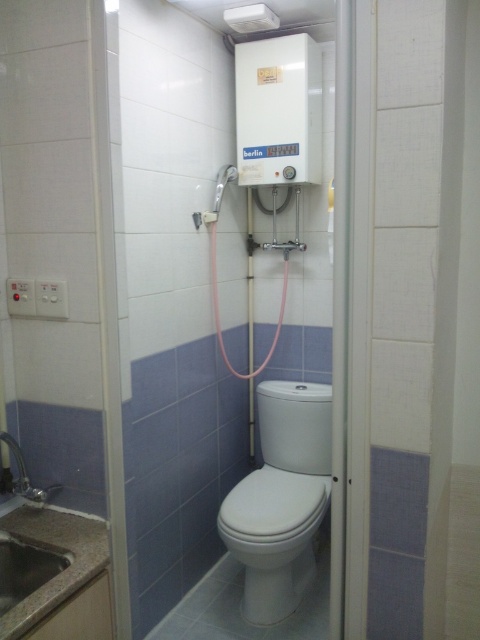
You are standing in the bathroom and need to locate two specific points marked on the wall. The first point is at coordinates point [51,577] and the second is at point [237,176]. From your perspective facing the wall, which point is closer to you?

Point [51,577] is in front of point [237,176], so it is closer to you when facing the wall.

Based on the photo, you are a plumber checking the bathroom layout. You need to install a new pipe that connects the white glossy toilet at center and the matte white shower at upper center. Which object requires more space horizontally for the installation?

The white glossy toilet at center might be wider than the matte white shower at upper center, so it requires more horizontal space for installation.